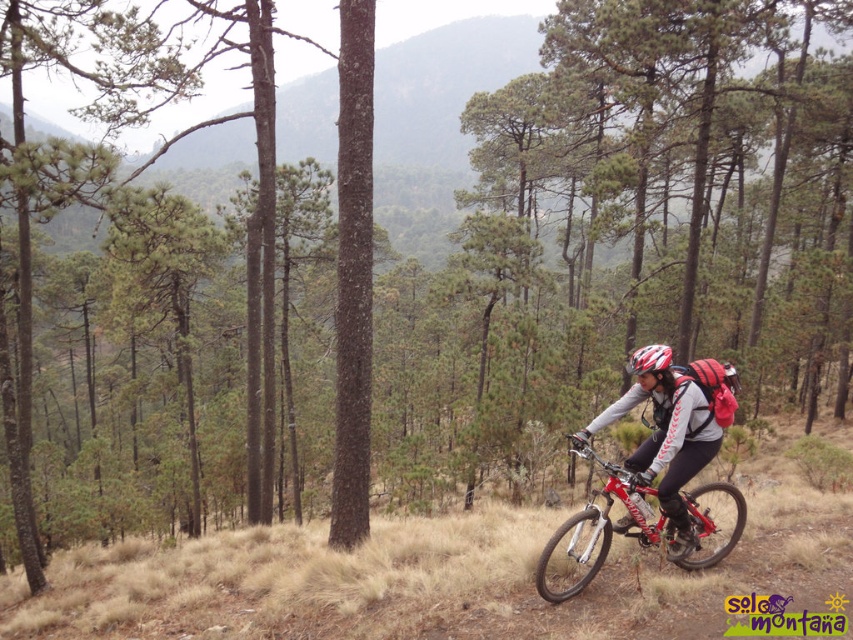
Does shiny metallic bicycle at right appear under matte white helmet at center?

Yes.

Does shiny metallic bicycle at right have a greater width compared to matte white helmet at center?

Yes, shiny metallic bicycle at right is wider than matte white helmet at center.

Is point (643, 529) closer to viewer compared to point (651, 358)?

No, (643, 529) is further to viewer.

At what (x,y) coordinates should I click in order to perform the action: click on shiny metallic bicycle at right. Please return your answer as a coordinate pair (x, y). This screenshot has height=640, width=853. Looking at the image, I should click on (637, 531).

Is matte black helmet at center above shiny metallic bicycle at right?

Yes, matte black helmet at center is above shiny metallic bicycle at right.

In the scene shown: Which of these two, matte black helmet at center or shiny metallic bicycle at right, stands taller?

Standing taller between the two is matte black helmet at center.

Is point (665, 506) positioned behind point (544, 592)?

Yes, it is behind point (544, 592).

You are a GUI agent. You are given a task and a screenshot of the screen. Output one action in this format:
    pyautogui.click(x=<x>, y=<y>)
    Task: Click on the matte black helmet at center
    
    Given the screenshot: What is the action you would take?
    [x=672, y=426]

Is matte black helmet at center to the right of matte white helmet at center from the viewer's perspective?

Yes, matte black helmet at center is to the right of matte white helmet at center.

Who is more forward, (662,420) or (634,352)?

Point (662,420) is in front.

Identify the location of matte black helmet at center. This screenshot has height=640, width=853. (672, 426).

Identify the location of matte black helmet at center. pos(672,426).